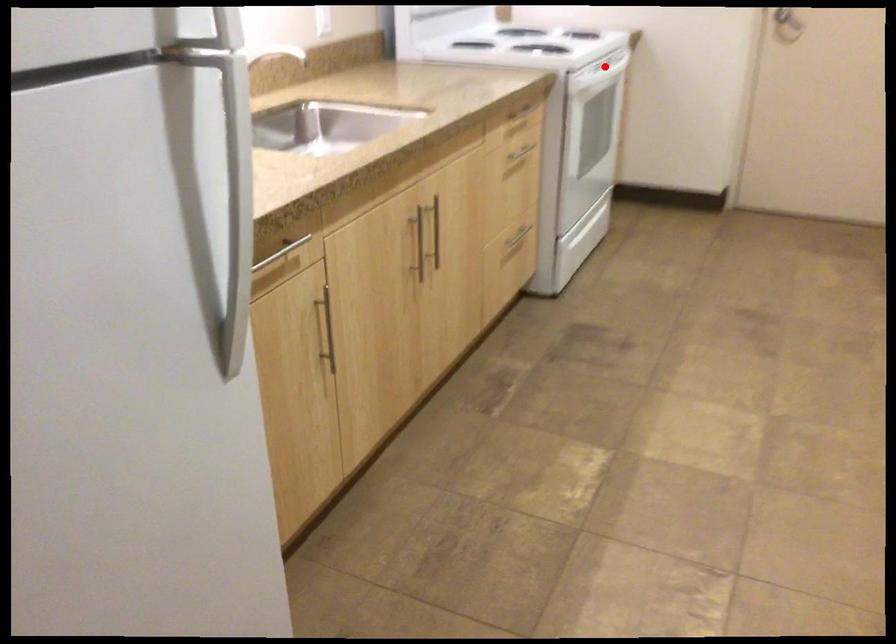
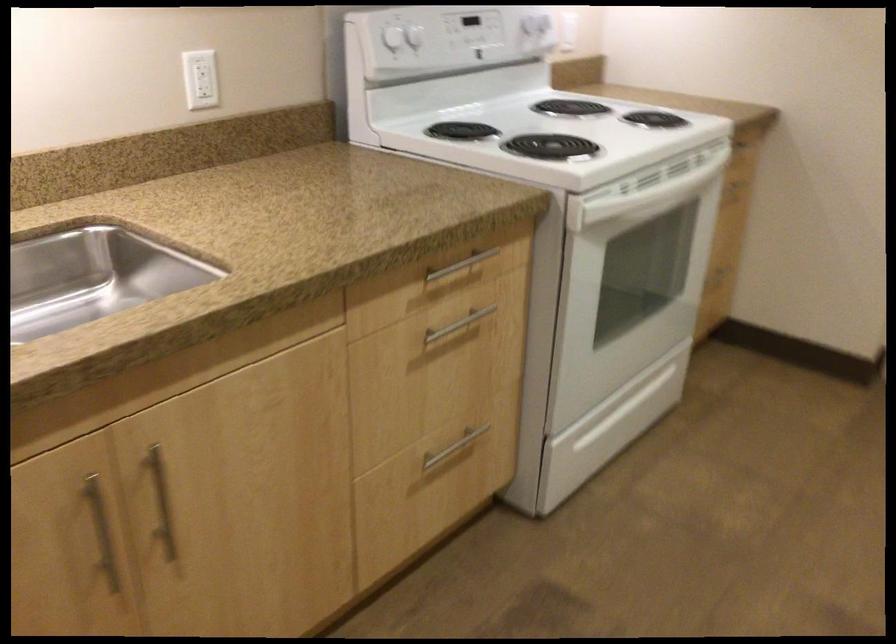
In the second image, find the point that corresponds to the highlighted location in the first image.

(645, 196)